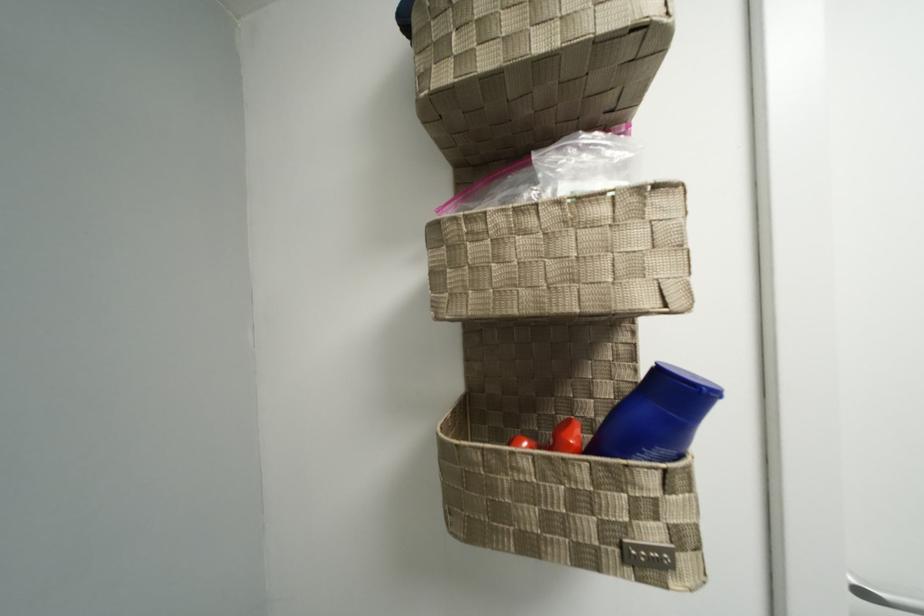
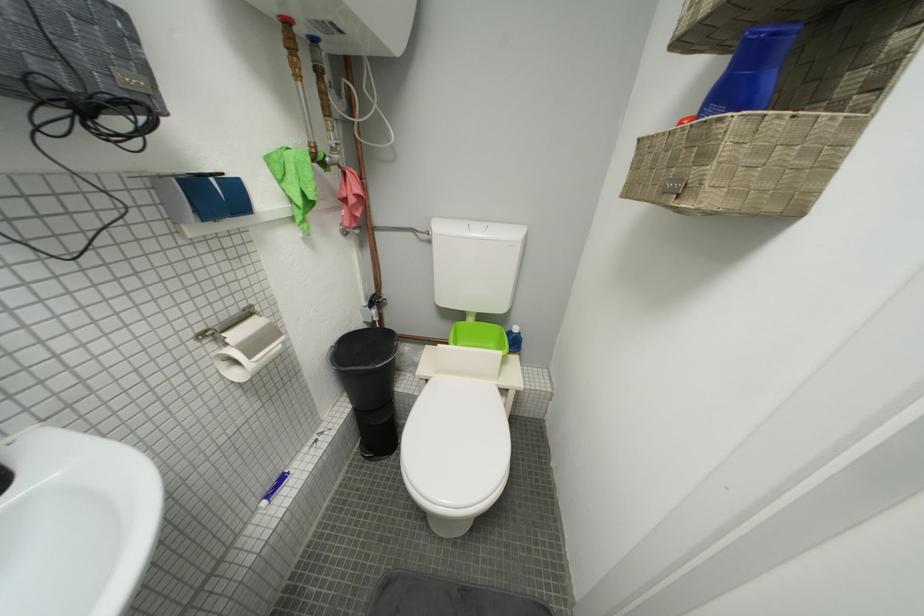
The first image is from the beginning of the video and the second image is from the end. How did the camera likely rotate when shooting the video?

The rotation direction of the camera is left-down.